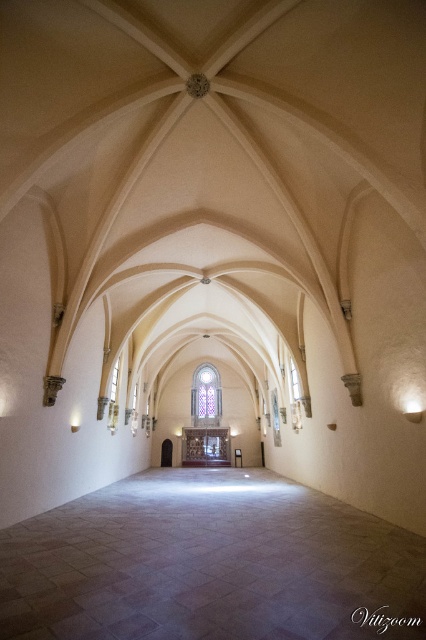
Question: Does stained glass window at center appear over transparent glass window at center?

Choices:
 (A) no
 (B) yes

Answer: (A)

Question: Does stained glass window at center appear under transparent glass window at center?

Choices:
 (A) no
 (B) yes

Answer: (B)

Question: Which of the following is the farthest from the observer?

Choices:
 (A) coord(216,403)
 (B) coord(293,397)

Answer: (A)

Question: Is stained glass window at center smaller than transparent glass window at center?

Choices:
 (A) no
 (B) yes

Answer: (A)

Question: Which of the following is the closest to the observer?

Choices:
 (A) stained glass window at center
 (B) transparent glass window at center

Answer: (B)